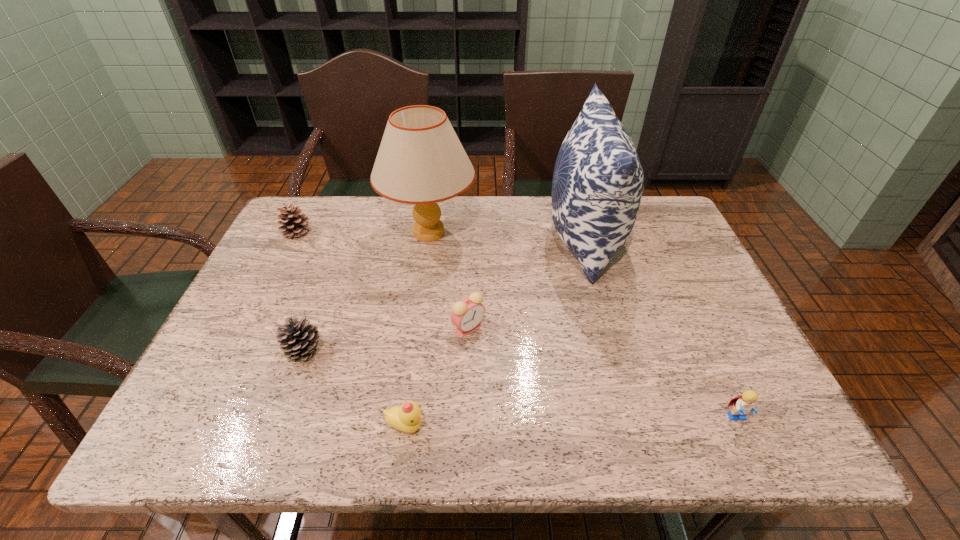
This screenshot has width=960, height=540. I want to click on vacant point located 0.250m on the front surface of the cushion, so click(460, 239).

The width and height of the screenshot is (960, 540). What are the coordinates of `free space located on the front surface of the cushion` in the screenshot? It's located at 519,239.

The width and height of the screenshot is (960, 540). In order to click on free point located 0.160m on the front of the lampshade in this screenshot , I will do pyautogui.click(x=419, y=307).

The height and width of the screenshot is (540, 960). I want to click on blank space located on the right of the farther pinecone, so click(371, 232).

I want to click on vacant area located 0.170m on the face of the alarm clock, so click(x=467, y=406).

At what (x,y) coordinates should I click in order to perform the action: click on vacant space located on the left of the sixth object from right to left. Please return your answer as a coordinate pair (x, y). Looking at the image, I should click on (221, 349).

Where is `vacant area located on the front-facing side of the duckling`? vacant area located on the front-facing side of the duckling is located at coordinates (474, 426).

Where is `cushion at the far edge`? This screenshot has width=960, height=540. cushion at the far edge is located at coordinates (597, 186).

Find the location of a particular element. Image resolution: width=960 pixels, height=540 pixels. lampshade present at the far edge is located at coordinates (421, 161).

Locate an element on the screen. pinecone present at the far edge is located at coordinates (294, 222).